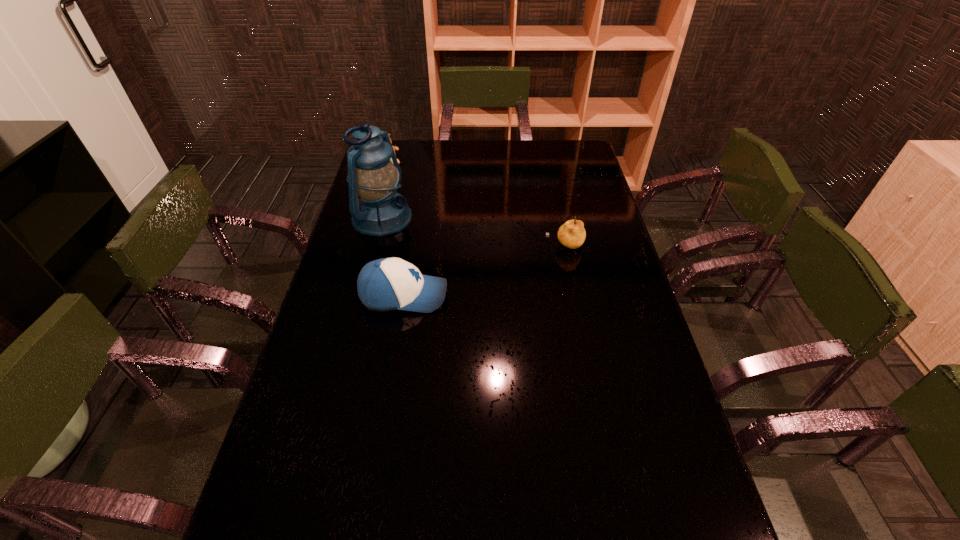
In the image, there is a desktop. Where is `free space at the left edge`? The height and width of the screenshot is (540, 960). free space at the left edge is located at coordinates 346,415.

The image size is (960, 540). Identify the location of free spot at the right edge of the desktop. (578, 259).

In order to click on vacant space at the far right corner in this screenshot , I will do `click(573, 145)`.

In the image, there is a desktop. In order to click on vacant area at the near right corner in this screenshot , I will do `click(647, 504)`.

Locate an element on the screen. Image resolution: width=960 pixels, height=540 pixels. free spot between the pear and the tallest object is located at coordinates (473, 233).

The image size is (960, 540). Find the location of `vacant space in between the rightmost object and the farthest object`. vacant space in between the rightmost object and the farthest object is located at coordinates (476, 204).

Image resolution: width=960 pixels, height=540 pixels. Find the location of `vacant space in between the baseball cap and the pear`. vacant space in between the baseball cap and the pear is located at coordinates (484, 271).

The height and width of the screenshot is (540, 960). What are the coordinates of `unoccupied area between the nearest object and the rightmost object` in the screenshot? It's located at (484, 271).

Find the location of a particular element. This screenshot has width=960, height=540. free point between the rightmost object and the teddy bear is located at coordinates (476, 204).

Identify which object is the nearest to the teddy bear. Please provide its 2D coordinates. Your answer should be formatted as a tuple, i.e. [(x, y)], where the tuple contains the x and y coordinates of a point satisfying the conditions above.

[(374, 176)]